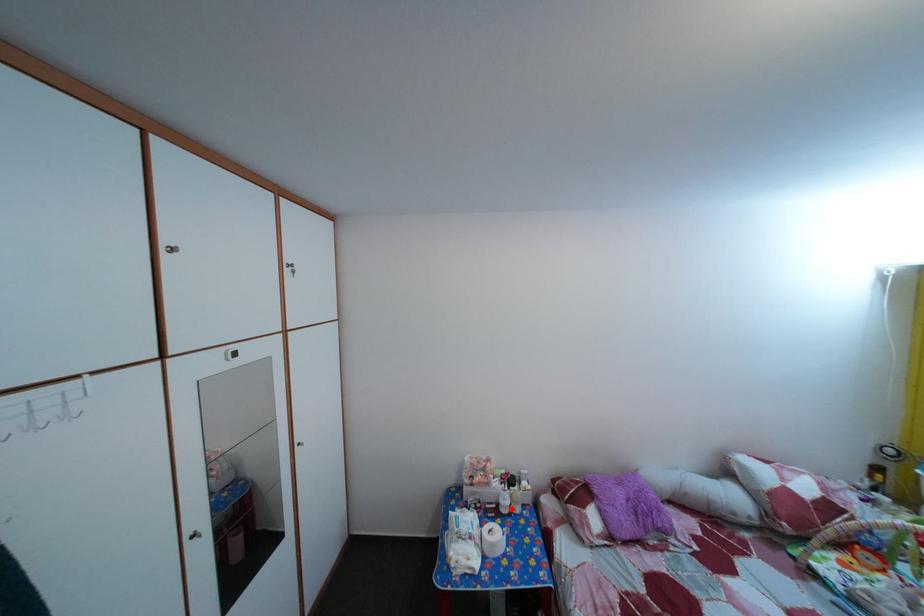
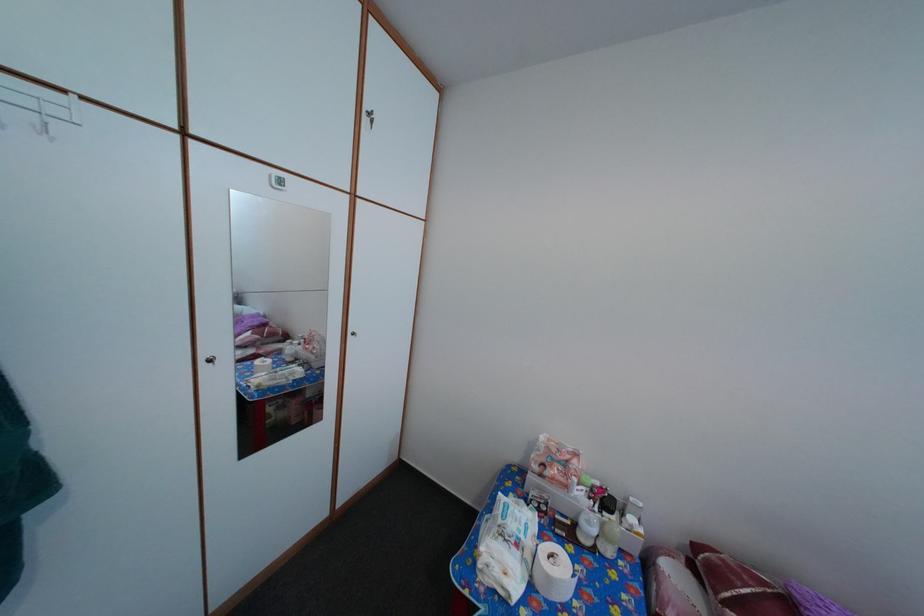
The point at the highlighted location is marked in the first image. Where is the corresponding point in the second image?

(592, 531)